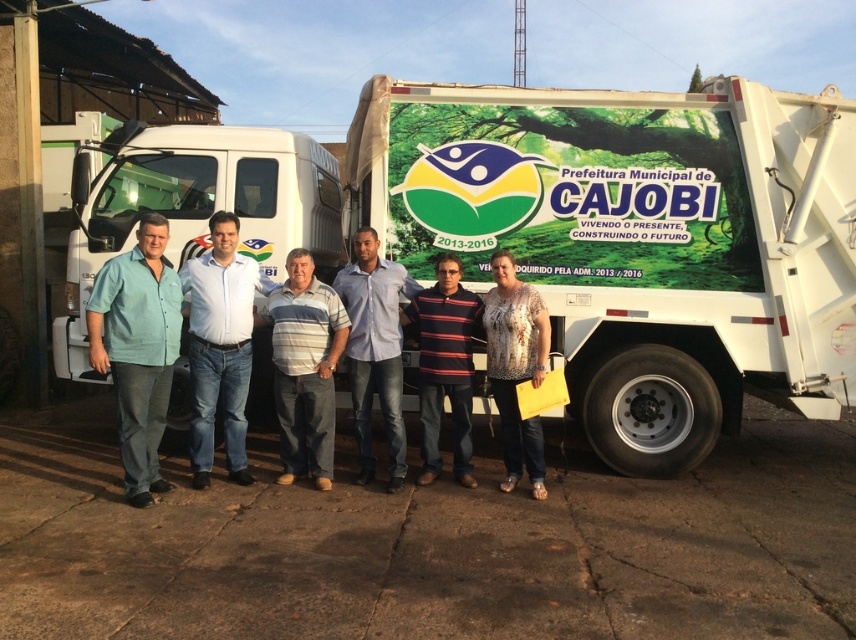
Where is the blue shirt at center located in the image?

The blue shirt at center is located at point (x=220, y=346).

What are the coordinates of the light blue shirt at center in the image?

The coordinates of the light blue shirt at center are at point (375, 349).

You are a photographer who needs to adjust the camera settings for a group photo. You notice two shirts in the scene, the teal matte shirt at left and the light blue shirt at center. Which shirt has a smaller width in the image?

The teal matte shirt at left has a lesser width compared to the light blue shirt at center, so the teal matte shirt at left has a smaller width.